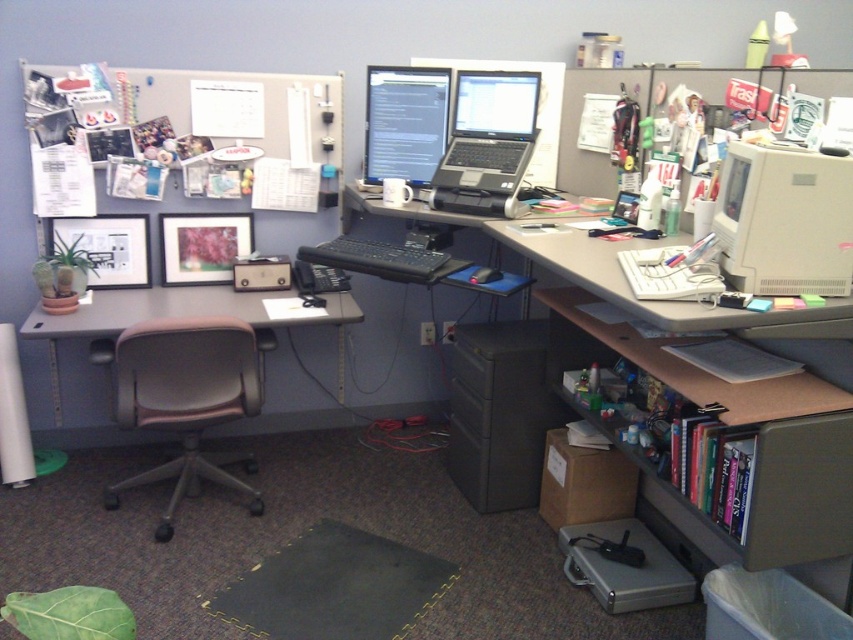
You are an office worker trying to locate two specific points in your cubicle. The first point is at coordinate point(x=140, y=394) and the second is at coordinate point(x=397, y=97). Which point is closer to you?

Point(x=140, y=394) is closer to the viewer than point(x=397, y=97).

You are an office worker who needs to move a box from the gray fabric swivel chair at lower left to the white plastic monitor at upper right. Which object is wider so you can decide which side to approach from?

The gray fabric swivel chair at lower left might be wider than white plastic monitor at upper right, so you should approach from the side of the gray fabric swivel chair at lower left to ensure enough space.